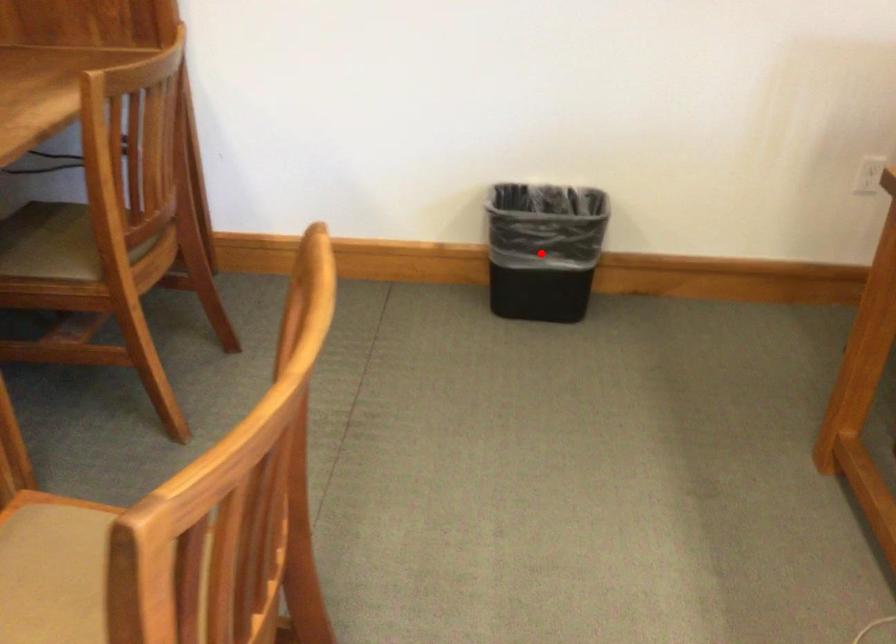
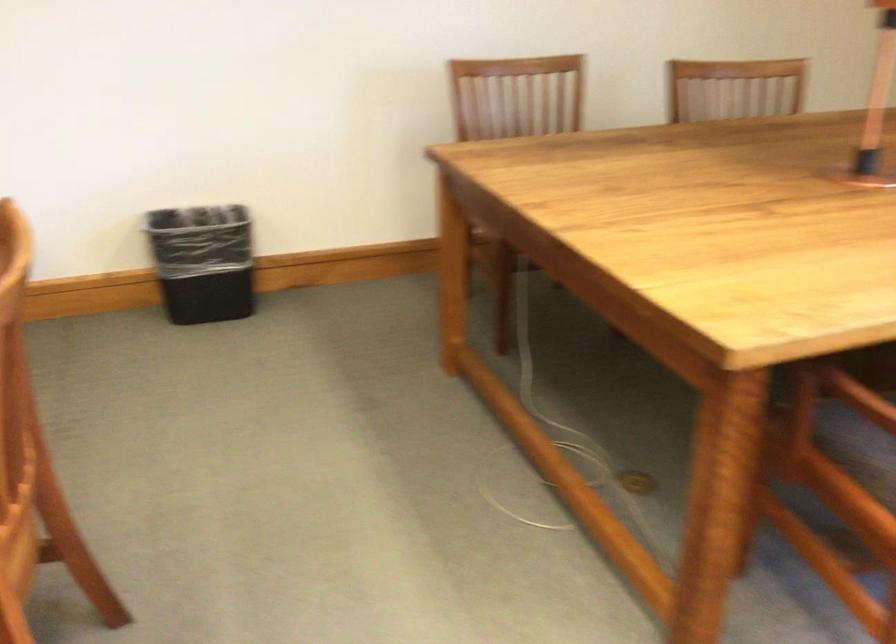
In the second image, find the point that corresponds to the highlighted location in the first image.

(202, 261)